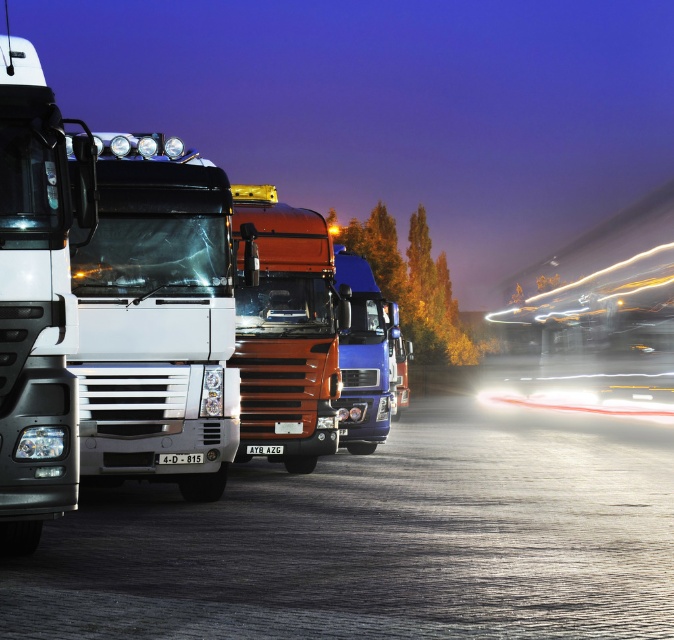
Question: Is white glossy trailer truck at left smaller than matte white headlight at left?

Choices:
 (A) yes
 (B) no

Answer: (B)

Question: Among these points, which one is farthest from the camera?

Choices:
 (A) (30, 296)
 (B) (253, 316)

Answer: (B)

Question: Which object is farther from the camera taking this photo?

Choices:
 (A) white glossy trailer truck at left
 (B) glossy blue truck at center

Answer: (B)

Question: Which object is the farthest from the white glossy truck at center?

Choices:
 (A) matte white headlight at left
 (B) glossy blue truck at center
 (C) shiny orange truck at center
 (D) white glossy trailer truck at left

Answer: (B)

Question: Does white glossy truck at center appear over white glossy trailer truck at left?

Choices:
 (A) no
 (B) yes

Answer: (A)

Question: Can you confirm if white glossy truck at center is positioned below white glossy trailer truck at left?

Choices:
 (A) no
 (B) yes

Answer: (B)